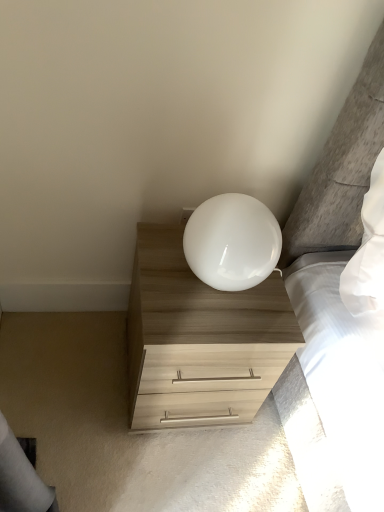
Locate an element on the screen. This screenshot has height=512, width=384. vacant space positioned to the left of white glossy lamp at upper center is located at coordinates (157, 261).